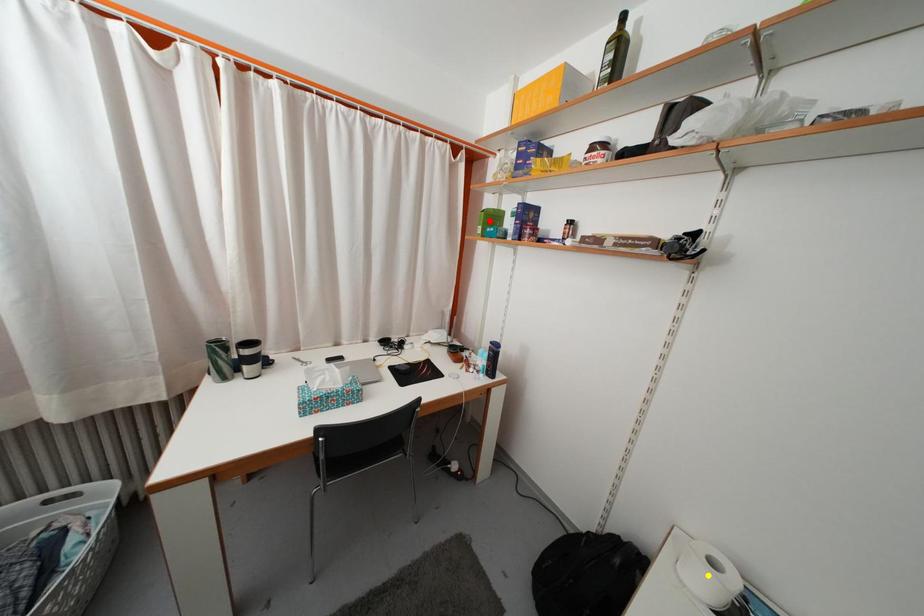
Order these from nearest to farthest:
yellow point, orange point, red point

yellow point < orange point < red point